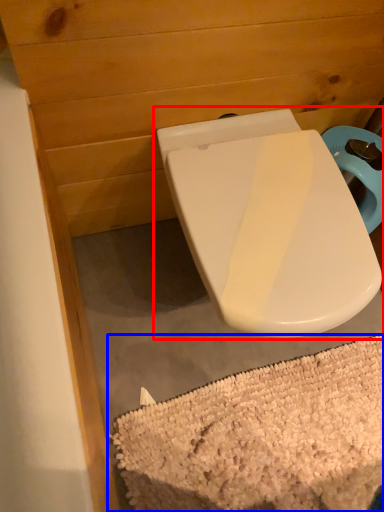
Question: Which point is closer to the camera, toilet (highlighted by a red box) or bath mat (highlighted by a blue box)?

Choices:
 (A) toilet
 (B) bath mat

Answer: (A)